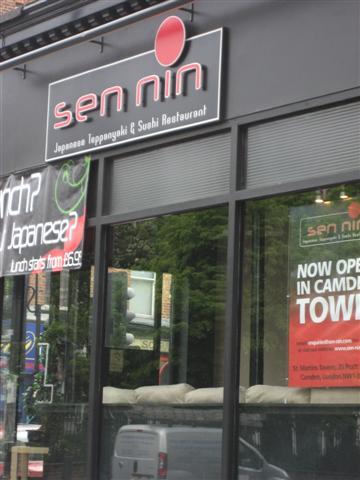
Find the location of a particular element. This screenshot has height=480, width=360. glass is located at coordinates (255, 329), (174, 345), (57, 353).